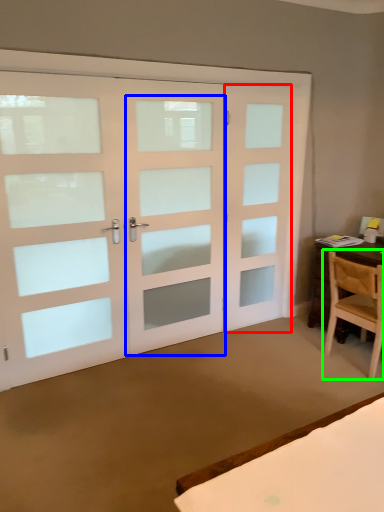
Question: Which object is positioned farthest from screen door (highlighted by a red box)? Select from screen door (highlighted by a blue box) and chair (highlighted by a green box).

Choices:
 (A) screen door
 (B) chair

Answer: (B)